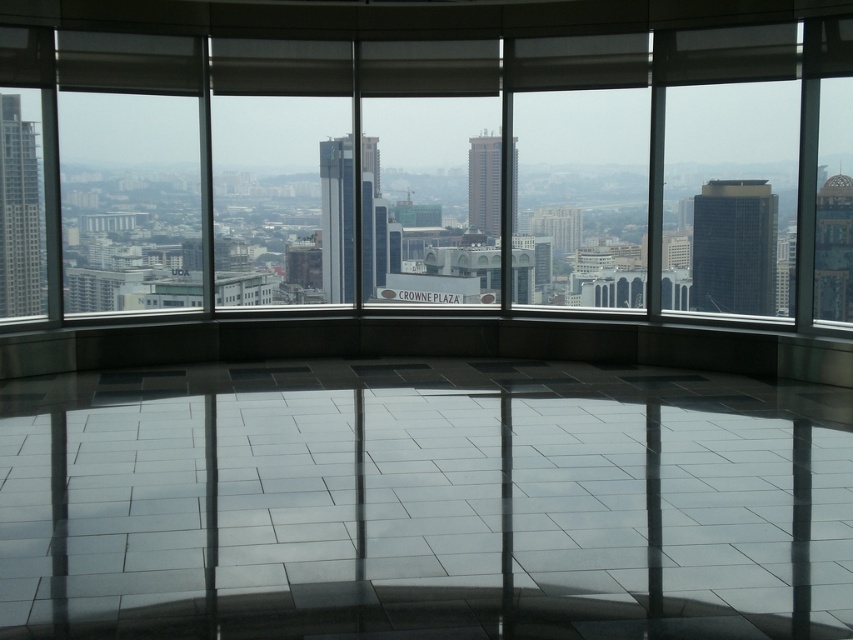
Which is more to the left, black glass tower at right or matte glass tower at center?

Positioned to the left is matte glass tower at center.

Does black glass tower at right come behind matte glass tower at center?

That is True.

What do you see at coordinates (734, 248) in the screenshot?
I see `black glass tower at right` at bounding box center [734, 248].

This screenshot has width=853, height=640. Identify the location of black glass tower at right. point(734,248).

At what (x,y) coordinates should I click in order to perform the action: click on glassy reflective skyscraper at center. Please return your answer as a coordinate pair (x, y). Looking at the image, I should click on (337, 218).

Does glassy reflective skyscraper at center have a smaller size compared to matte glass tower at center?

No, glassy reflective skyscraper at center is not smaller than matte glass tower at center.

This screenshot has width=853, height=640. What do you see at coordinates (337, 218) in the screenshot?
I see `glassy reflective skyscraper at center` at bounding box center [337, 218].

Image resolution: width=853 pixels, height=640 pixels. Find the location of `glassy reflective skyscraper at center`. glassy reflective skyscraper at center is located at coordinates (337, 218).

Between black glass tower at right and matte glass skyscraper at left, which one has less height?

Standing shorter between the two is black glass tower at right.

Does point (718, 253) come farther from viewer compared to point (6, 276)?

That is True.

Where is `black glass tower at right`? The width and height of the screenshot is (853, 640). black glass tower at right is located at coordinates (734, 248).